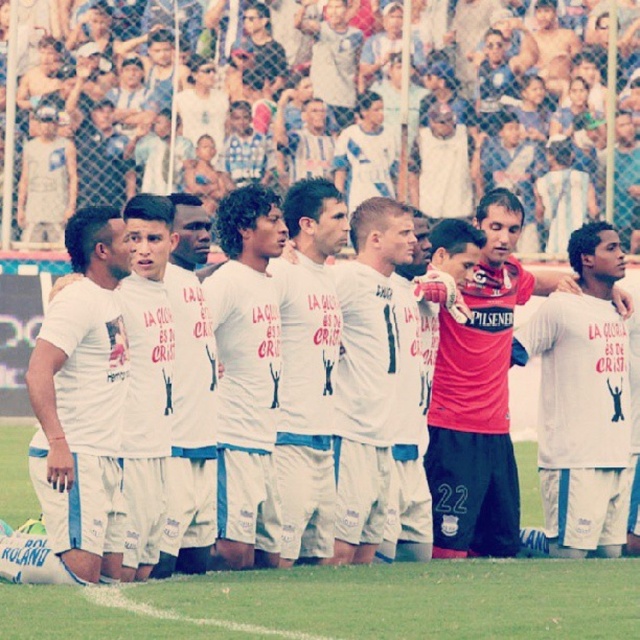
Between white cotton t-shirt at center and white cotton shirt at center, which one has less height?

With less height is white cotton shirt at center.

Does point (129, 460) come in front of point (556, 332)?

Yes.

You are a GUI agent. You are given a task and a screenshot of the screen. Output one action in this format:
    pyautogui.click(x=<x>, y=<y>)
    Task: Click on the white cotton t-shirt at center
    The image size is (640, 640).
    Given the screenshot: What is the action you would take?
    pyautogui.click(x=49, y=412)

Is white fabric grass at center thinner than white cotton shirt at center?

In fact, white fabric grass at center might be wider than white cotton shirt at center.

Is white fabric grass at center bigger than white cotton shirt at center?

Yes, white fabric grass at center is bigger than white cotton shirt at center.

Is point (93, 616) farther from camera compared to point (604, 456)?

No, (93, 616) is closer to viewer.

Identify the location of white fabric grass at center. The width and height of the screenshot is (640, 640). (348, 604).

Is white fabric grass at center taller than white cotton t-shirt at center?

Incorrect, white fabric grass at center's height is not larger of white cotton t-shirt at center's.

Who is higher up, white fabric grass at center or white cotton t-shirt at center?

white cotton t-shirt at center is higher up.

Does point (492, 632) lie behind point (38, 381)?

That is False.

Where is `white fabric grass at center`? This screenshot has width=640, height=640. white fabric grass at center is located at coordinates (348, 604).